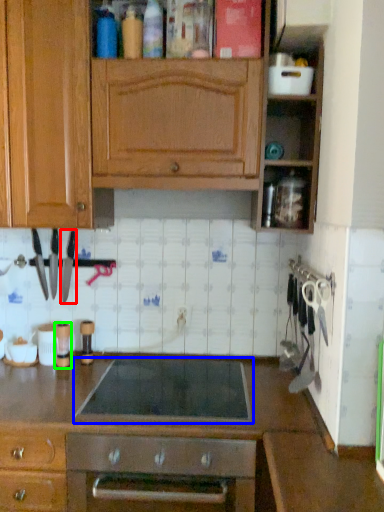
Question: Based on their relative distances, which object is nearer to kitchen appliance (highlighted by a red box)? Choose from gas stove (highlighted by a blue box) and appliance (highlighted by a green box).

Choices:
 (A) gas stove
 (B) appliance

Answer: (B)